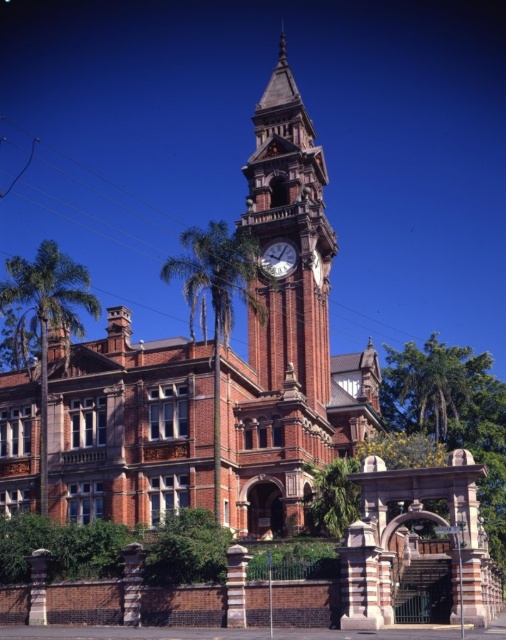
Is point (251, 268) positioned after point (273, 243)?

No, (251, 268) is in front of (273, 243).

Does green leafy palm tree at center appear over white glossy clock at upper center?

Incorrect, green leafy palm tree at center is not positioned above white glossy clock at upper center.

In order to click on green leafy palm tree at center in this screenshot , I will do `click(216, 298)`.

Is green leafy palm tree at left positioned at the back of green leafy palm tree at center?

Yes, it is.

Can you confirm if green leafy palm tree at left is positioned to the left of green leafy palm tree at center?

Yes, green leafy palm tree at left is to the left of green leafy palm tree at center.

Who is more distant from viewer, (25, 317) or (230, 269)?

The point (25, 317) is more distant.

Where is `green leafy palm tree at left`? This screenshot has height=640, width=506. green leafy palm tree at left is located at coordinates (44, 320).

Is point (47, 317) farther from viewer compared to point (292, 266)?

No.

Between green leafy palm tree at left and white glossy clock at upper center, which one has less height?

white glossy clock at upper center

Who is more distant from viewer, (55, 314) or (267, 262)?

The point (267, 262) is more distant.

The image size is (506, 640). Find the location of `green leafy palm tree at left`. green leafy palm tree at left is located at coordinates (x=44, y=320).